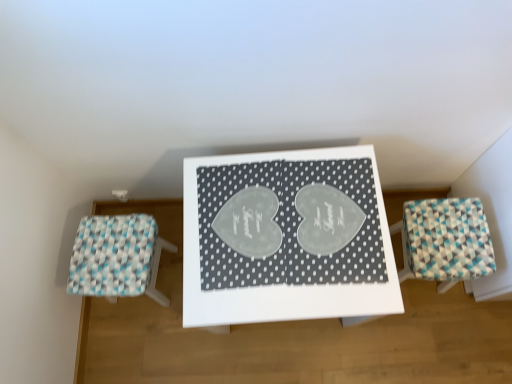
Question: Can we say teal-patterned stool at right, placed as the 2th furniture when sorted from left to right, lies outside white woven stool at left, the 1th furniture viewed from the left?

Choices:
 (A) yes
 (B) no

Answer: (A)

Question: Is teal-patterned stool at right, which is the 1th furniture in right-to-left order, positioned before white woven stool at left, the 1th furniture viewed from the left?

Choices:
 (A) no
 (B) yes

Answer: (B)

Question: Is teal-patterned stool at right, which is the 1th furniture in right-to-left order, in contact with white woven stool at left, the 1th furniture viewed from the left?

Choices:
 (A) no
 (B) yes

Answer: (A)

Question: Is teal-patterned stool at right, which is the 1th furniture in right-to-left order, taller than white woven stool at left, the 1th furniture viewed from the left?

Choices:
 (A) no
 (B) yes

Answer: (A)

Question: From a real-world perspective, is teal-patterned stool at right, placed as the 2th furniture when sorted from left to right, physically above white woven stool at left, the 1th furniture viewed from the left?

Choices:
 (A) yes
 (B) no

Answer: (A)

Question: Considering the positions of teal-patterned stool at right, placed as the 2th furniture when sorted from left to right, and white glossy table at center in the image, is teal-patterned stool at right, placed as the 2th furniture when sorted from left to right, wider or thinner than white glossy table at center?

Choices:
 (A) wide
 (B) thin

Answer: (B)

Question: Considering their positions, is teal-patterned stool at right, which is the 1th furniture in right-to-left order, located in front of or behind white glossy table at center?

Choices:
 (A) front
 (B) behind

Answer: (B)

Question: Is point (452, 274) closer or farther from the camera than point (362, 147)?

Choices:
 (A) closer
 (B) farther

Answer: (B)

Question: From the image's perspective, is teal-patterned stool at right, which is the 1th furniture in right-to-left order, positioned above or below white glossy table at center?

Choices:
 (A) below
 (B) above

Answer: (B)

Question: Considering their positions, is white woven stool at left, the 1th furniture viewed from the left, located in front of or behind white glossy table at center?

Choices:
 (A) front
 (B) behind

Answer: (B)

Question: From a real-world perspective, relative to white glossy table at center, is white woven stool at left, the 2th furniture positioned from the right, vertically above or below?

Choices:
 (A) below
 (B) above

Answer: (A)

Question: Is white woven stool at left, the 2th furniture positioned from the right, wider or thinner than white glossy table at center?

Choices:
 (A) wide
 (B) thin

Answer: (B)

Question: Is white woven stool at left, the 2th furniture positioned from the right, taller or shorter than white glossy table at center?

Choices:
 (A) tall
 (B) short

Answer: (B)

Question: In terms of height, does white glossy table at center look taller or shorter compared to white woven stool at left, the 2th furniture positioned from the right?

Choices:
 (A) short
 (B) tall

Answer: (B)

Question: Considering their positions, is white glossy table at center located in front of or behind white woven stool at left, the 1th furniture viewed from the left?

Choices:
 (A) front
 (B) behind

Answer: (A)